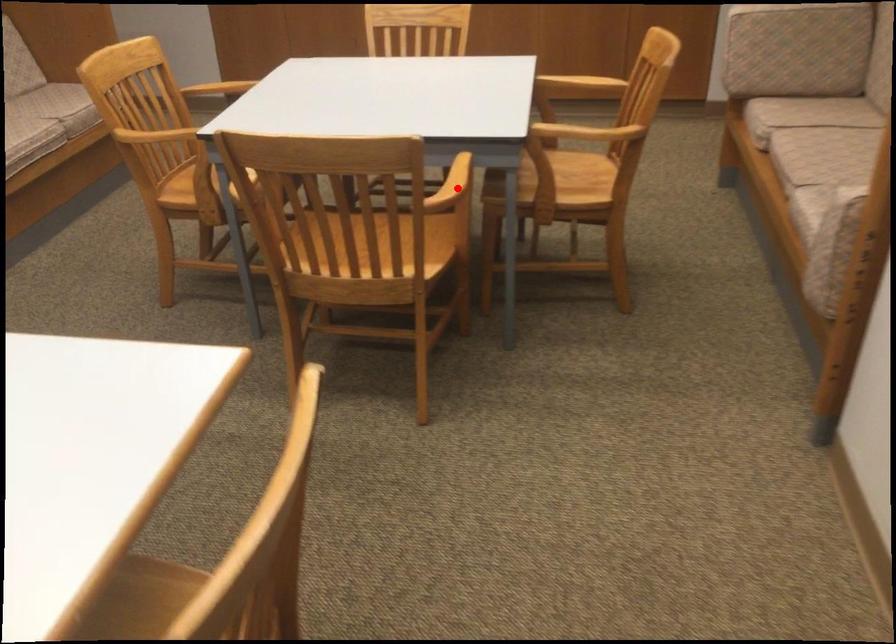
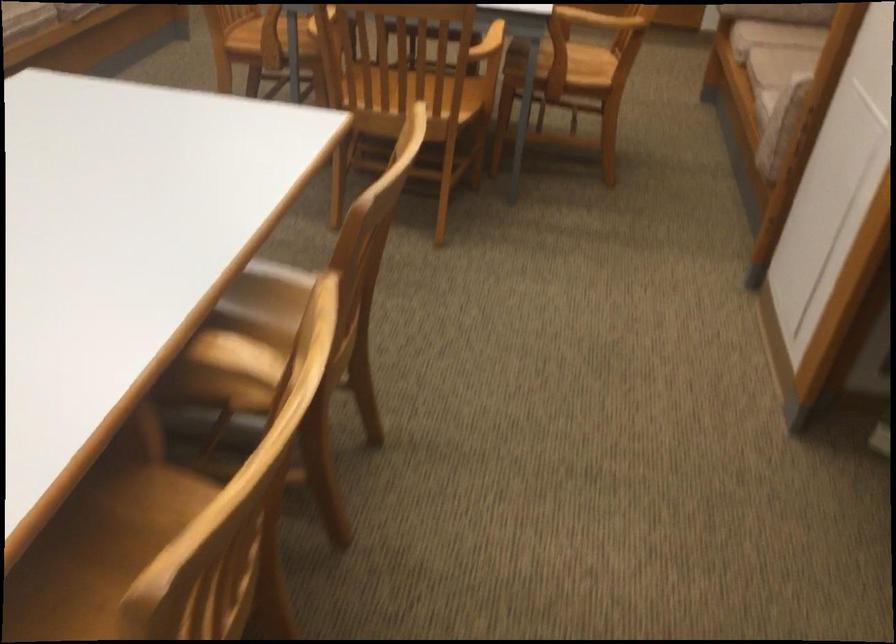
Where in the second image is the point corresponding to the highlighted location from the first image?

(488, 43)